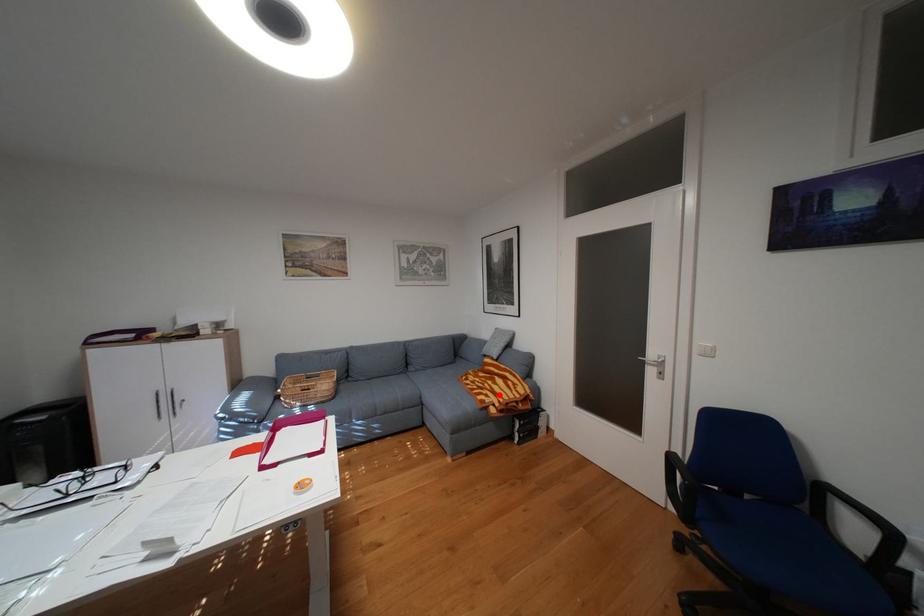
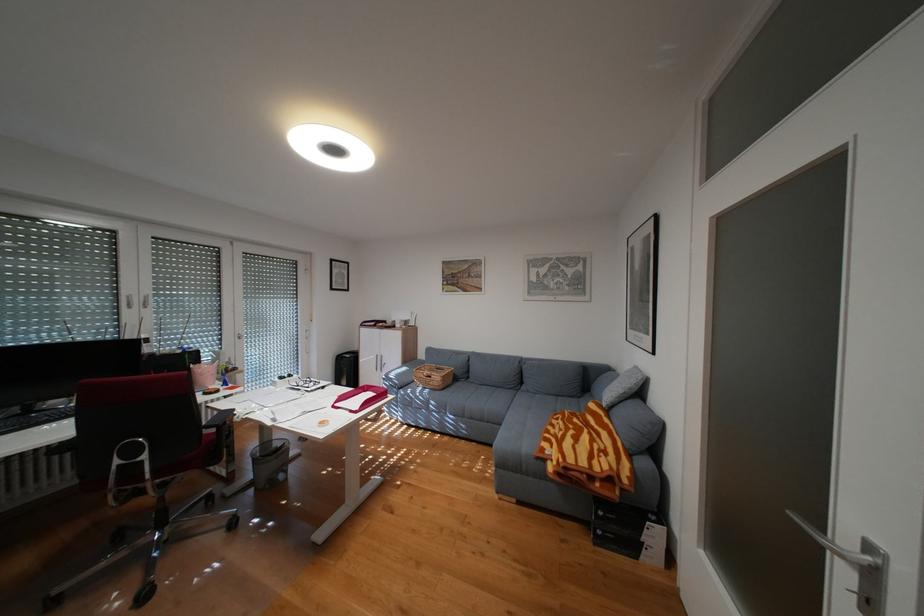
Question: I am providing you with two images of the same scene from different viewpoints. Image1 has a red point marked. In image2, the corresponding 3D location appears at what relative position? Reply with the corresponding letter.

Choices:
 (A) Closer
 (B) Farther

Answer: (A)